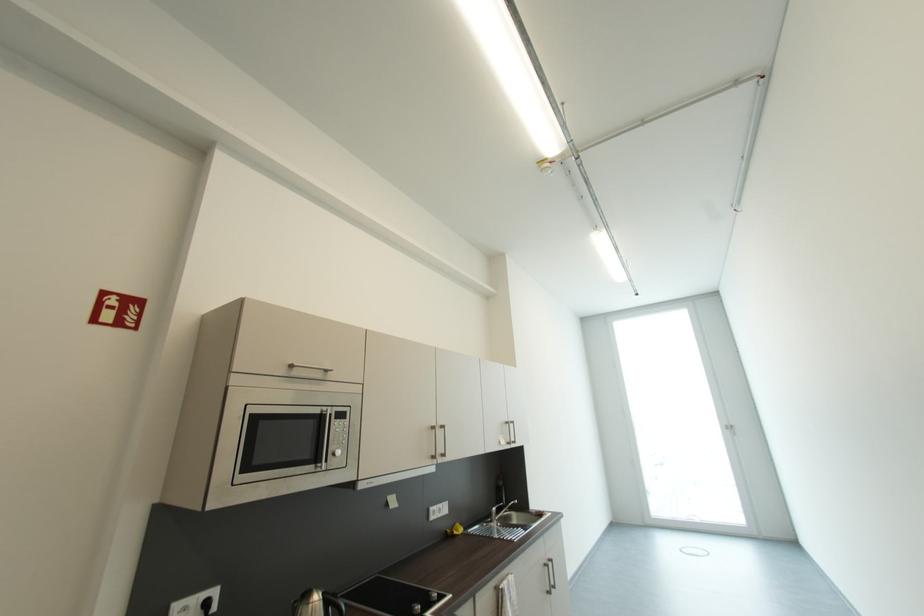
What do you see at coordinates (326, 440) in the screenshot? I see `the microwave door handle` at bounding box center [326, 440].